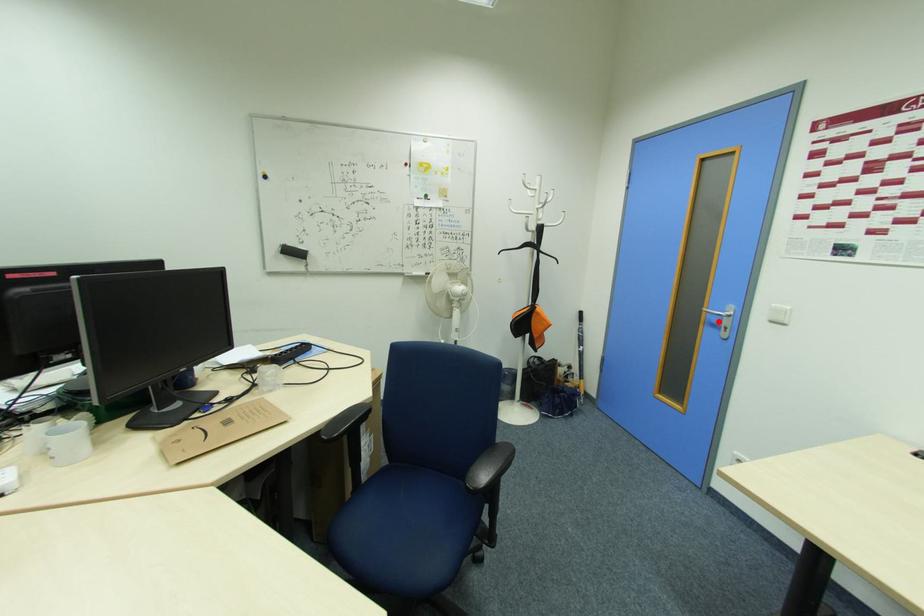
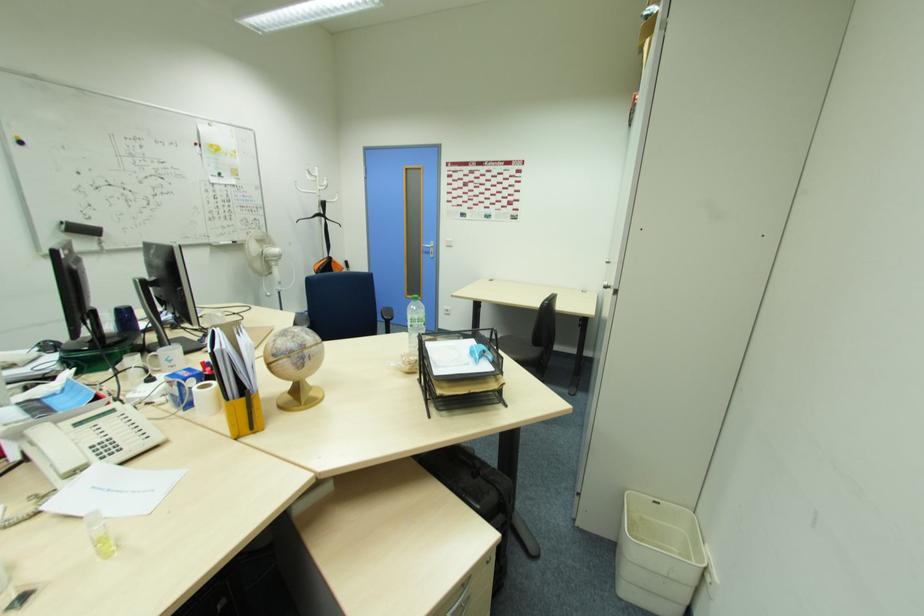
Question: A red point is marked in image1. In image2, is the corresponding 3D point closer to the camera or farther? Reply with the corresponding letter.

Choices:
 (A) The corresponding 3D point is closer.
 (B) The corresponding 3D point is farther.

Answer: (A)